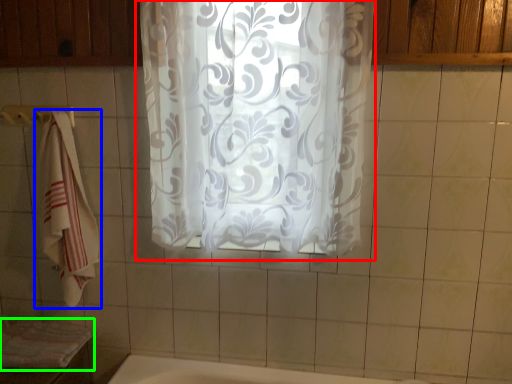
Question: Based on their relative distances, which object is farther from curtain (highlighted by a red box)? Choose from towel (highlighted by a blue box) and bath towel (highlighted by a green box).

Choices:
 (A) towel
 (B) bath towel

Answer: (B)